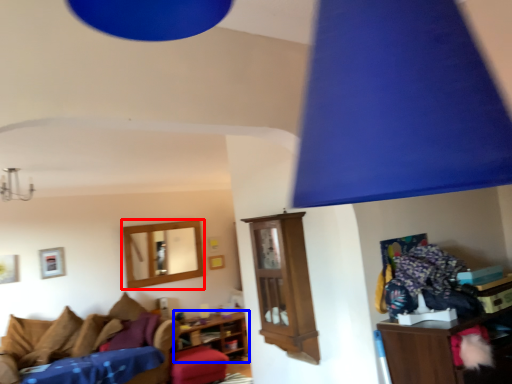
Question: Which point is closer to the camera, picture frame (highlighted by a red box) or shelf (highlighted by a blue box)?

Choices:
 (A) picture frame
 (B) shelf

Answer: (B)